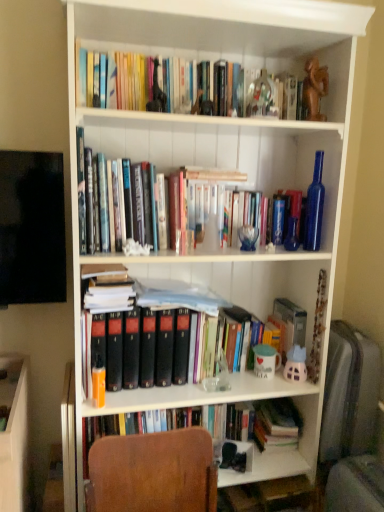
Question: Does orange matte book at left have a lesser height compared to brown wooden statue at upper center?

Choices:
 (A) no
 (B) yes

Answer: (B)

Question: Is orange matte book at left to the right of brown wooden statue at upper center from the viewer's perspective?

Choices:
 (A) yes
 (B) no

Answer: (B)

Question: Does orange matte book at left have a smaller size compared to brown wooden statue at upper center?

Choices:
 (A) no
 (B) yes

Answer: (B)

Question: Does orange matte book at left lie in front of brown wooden statue at upper center?

Choices:
 (A) yes
 (B) no

Answer: (A)

Question: Does orange matte book at left have a larger size compared to brown wooden statue at upper center?

Choices:
 (A) yes
 (B) no

Answer: (B)

Question: Does orange matte book at left appear on the left side of brown wooden statue at upper center?

Choices:
 (A) no
 (B) yes

Answer: (B)

Question: From a real-world perspective, is hardcover books at upper center positioned over orange matte book at left based on gravity?

Choices:
 (A) no
 (B) yes

Answer: (B)

Question: Is the position of hardcover books at upper center more distant than that of orange matte book at left?

Choices:
 (A) no
 (B) yes

Answer: (A)

Question: Is hardcover books at upper center beside orange matte book at left?

Choices:
 (A) yes
 (B) no

Answer: (B)

Question: Can you confirm if hardcover books at upper center is positioned to the left of orange matte book at left?

Choices:
 (A) yes
 (B) no

Answer: (B)

Question: Does hardcover books at upper center have a lesser width compared to orange matte book at left?

Choices:
 (A) yes
 (B) no

Answer: (B)

Question: Is hardcover books at upper center positioned beyond the bounds of orange matte book at left?

Choices:
 (A) no
 (B) yes

Answer: (B)

Question: Is hardcover books at upper center surrounding brown wooden statue at upper center?

Choices:
 (A) yes
 (B) no

Answer: (B)